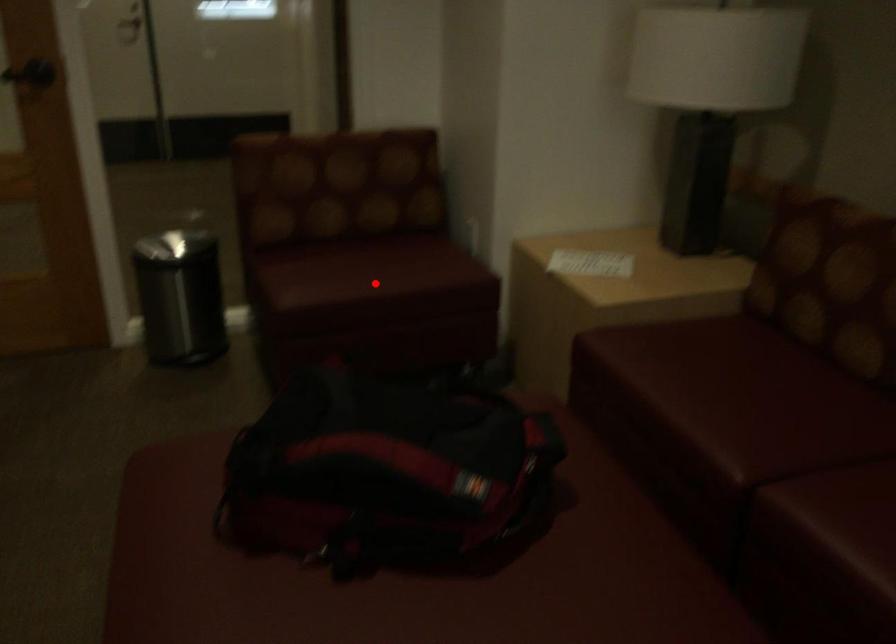
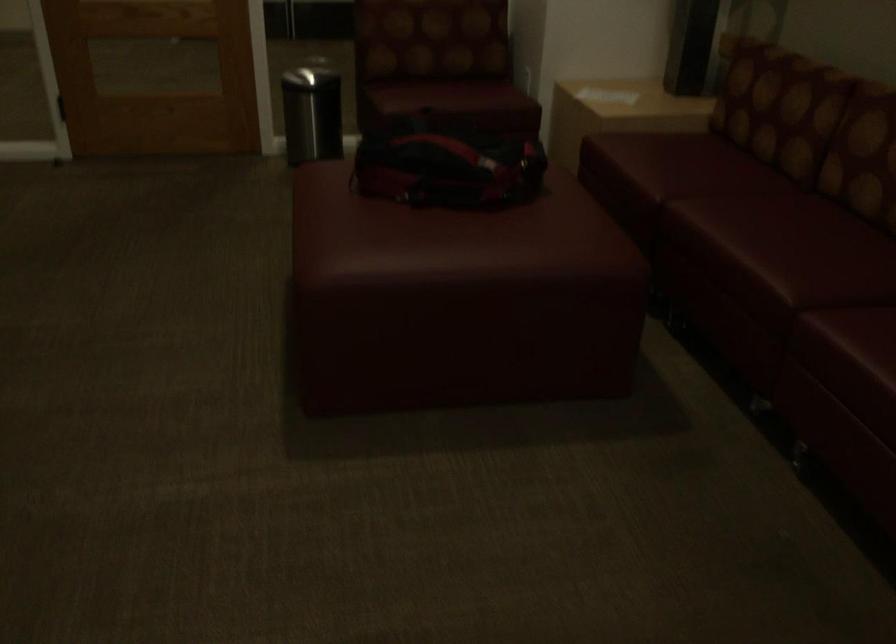
Question: I am providing you with two images of the same scene from different viewpoints. A red point is shown in image1. For the corresponding object point in image2, is it positioned nearer or farther from the camera?

Choices:
 (A) Nearer
 (B) Farther

Answer: (B)